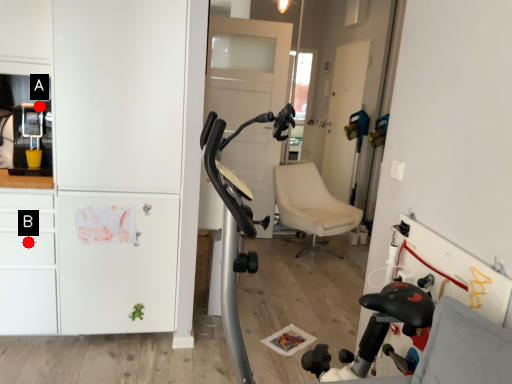
Question: Two points are circled on the image, labeled by A and B beside each circle. Which point is closer to the camera?

Choices:
 (A) A is closer
 (B) B is closer

Answer: (B)